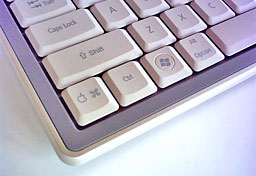
You are a GUI agent. You are given a task and a screenshot of the screen. Output one action in this format:
    pyautogui.click(x=<x>, y=<y>)
    Task: Click on the keyboard
    The image size is (256, 176).
    Given the screenshot: What is the action you would take?
    pyautogui.click(x=130, y=53)